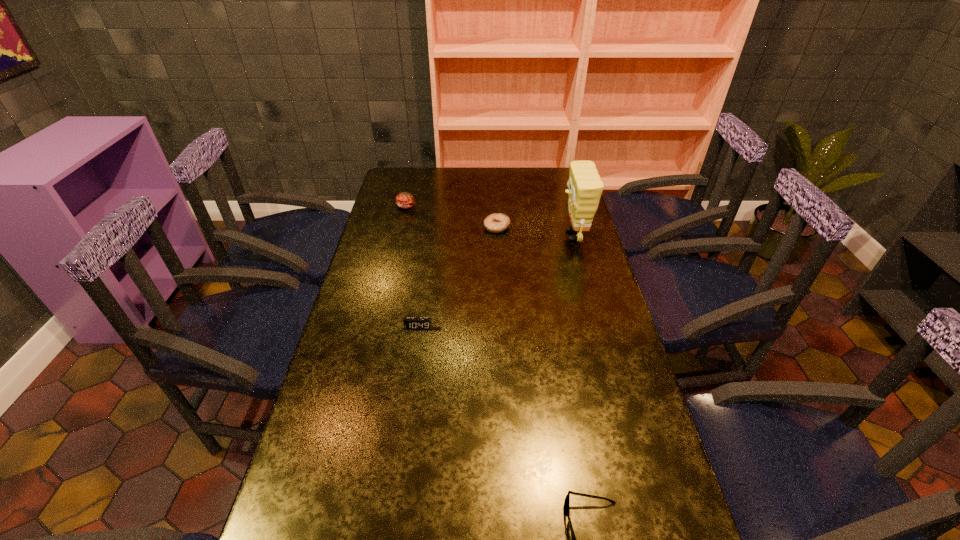
Image resolution: width=960 pixels, height=540 pixels. What are the coordinates of `free space located on the right of the fourth shortest object` in the screenshot? It's located at (437, 206).

You are a GUI agent. You are given a task and a screenshot of the screen. Output one action in this format:
    pyautogui.click(x=<x>, y=<y>)
    Task: Click on the free space located on the front of the doughnut
    
    Given the screenshot: What is the action you would take?
    pyautogui.click(x=501, y=307)

The image size is (960, 540). Identify the location of free spot located on the front-facing side of the second nearest object. (415, 351).

You are a GUI agent. You are given a task and a screenshot of the screen. Output one action in this format:
    pyautogui.click(x=<x>, y=<y>)
    Task: Click on the object that is at the left edge
    The image size is (960, 540).
    Given the screenshot: What is the action you would take?
    pyautogui.click(x=405, y=200)

The image size is (960, 540). I want to click on object at the right edge, so click(585, 187).

The height and width of the screenshot is (540, 960). I want to click on free space at the far edge of the desktop, so click(x=461, y=191).

This screenshot has height=540, width=960. Find the location of `free region at the left edge of the desktop`. free region at the left edge of the desktop is located at coordinates (296, 514).

Identify the location of free space at the right edge of the desktop. (586, 327).

In order to click on vacant space at the far right corner of the desktop in this screenshot , I will do `click(548, 173)`.

Where is `free spot between the sponge and the third object from right to left`? free spot between the sponge and the third object from right to left is located at coordinates (536, 231).